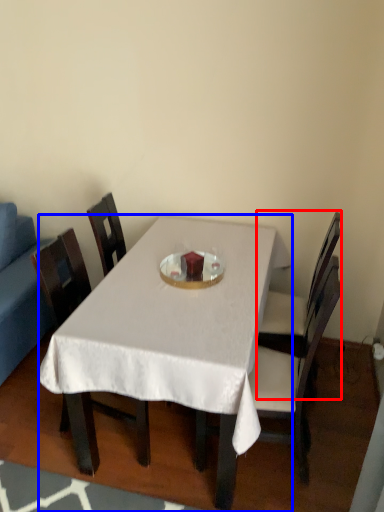
Question: Which object appears farthest to the camera in this image, chair (highlighted by a red box) or desk (highlighted by a blue box)?

Choices:
 (A) chair
 (B) desk

Answer: (A)